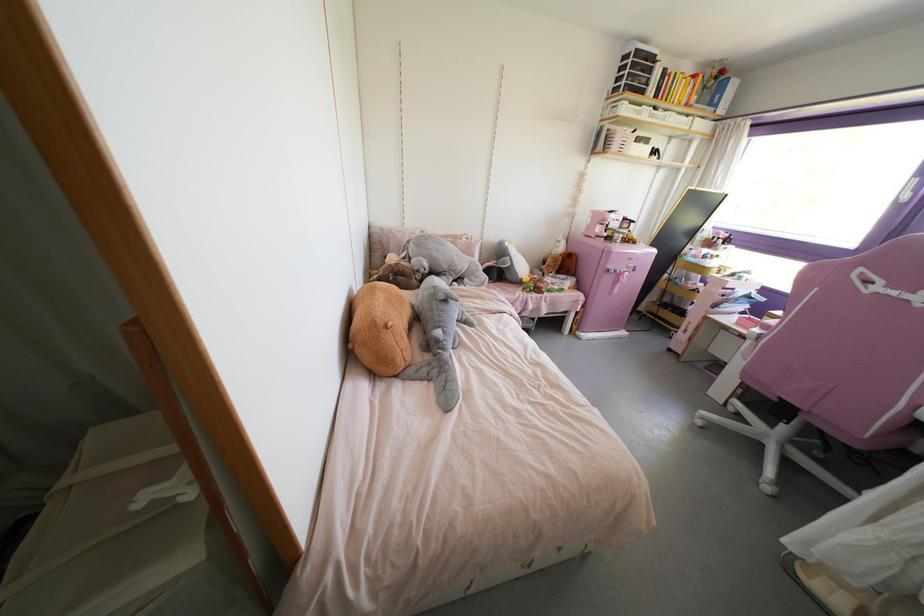
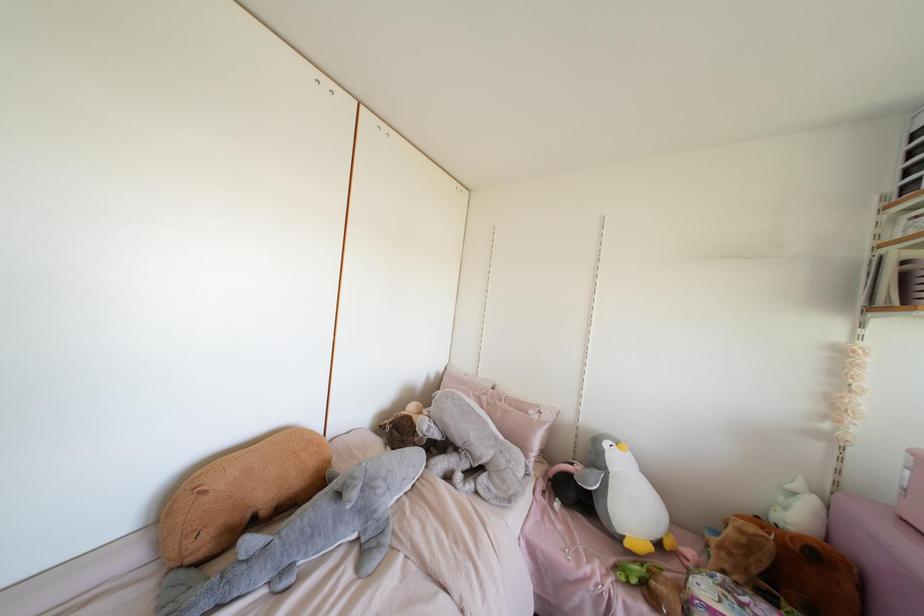
The point at (464,238) is marked in the first image. Where is the corresponding point in the second image?

(530, 411)